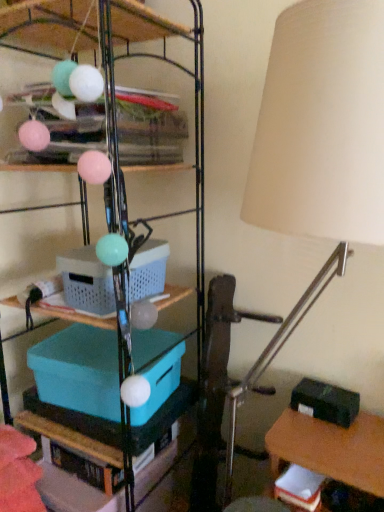
Question: Is black matte storage box at lower right, marked as the 1th storage box in a right-to-left arrangement, closer to camera compared to teal plastic storage box at center-left, acting as the first storage box starting from the left?

Choices:
 (A) yes
 (B) no

Answer: (B)

Question: Considering the relative positions of black matte storage box at lower right, the 3th storage box from the left, and teal plastic storage box at center-left, acting as the first storage box starting from the left, in the image provided, is black matte storage box at lower right, the 3th storage box from the left, to the right of teal plastic storage box at center-left, acting as the first storage box starting from the left, from the viewer's perspective?

Choices:
 (A) yes
 (B) no

Answer: (A)

Question: Does black matte storage box at lower right, which is counted as the third storage box, starting from the top, lie behind teal plastic storage box at center-left, which ranks as the second storage box in bottom-to-top order?

Choices:
 (A) yes
 (B) no

Answer: (A)

Question: Is black matte storage box at lower right, positioned as the first storage box in bottom-to-top order, not close to teal plastic storage box at center-left, which ranks as the third storage box in right-to-left order?

Choices:
 (A) no
 (B) yes

Answer: (A)

Question: Is black matte storage box at lower right, which is counted as the third storage box, starting from the top, positioned beyond the bounds of teal plastic storage box at center-left, acting as the first storage box starting from the left?

Choices:
 (A) yes
 (B) no

Answer: (A)

Question: Can you confirm if black matte storage box at lower right, marked as the 1th storage box in a right-to-left arrangement, is wider than teal plastic storage box at center-left, which ranks as the second storage box in bottom-to-top order?

Choices:
 (A) no
 (B) yes

Answer: (A)

Question: Could you tell me if plastic basket at center, which appears as the 2th storage box when viewed from the left, is facing black matte storage box at lower right, which is counted as the third storage box, starting from the top?

Choices:
 (A) no
 (B) yes

Answer: (A)

Question: Is plastic basket at center, arranged as the 3th storage box when ordered from the bottom, behind black matte storage box at lower right, positioned as the first storage box in bottom-to-top order?

Choices:
 (A) no
 (B) yes

Answer: (A)

Question: Are plastic basket at center, acting as the first storage box starting from the top, and black matte storage box at lower right, marked as the 1th storage box in a right-to-left arrangement, beside each other?

Choices:
 (A) no
 (B) yes

Answer: (A)

Question: Does plastic basket at center, which appears as the 2th storage box when viewed from the left, have a lesser width compared to black matte storage box at lower right, marked as the 1th storage box in a right-to-left arrangement?

Choices:
 (A) no
 (B) yes

Answer: (A)

Question: Can you confirm if plastic basket at center, placed as the 2th storage box when sorted from right to left, is smaller than black matte storage box at lower right, which is counted as the third storage box, starting from the top?

Choices:
 (A) no
 (B) yes

Answer: (A)

Question: Is plastic basket at center, which appears as the 2th storage box when viewed from the left, taller than black matte storage box at lower right, marked as the 1th storage box in a right-to-left arrangement?

Choices:
 (A) yes
 (B) no

Answer: (A)

Question: Is black matte storage box at lower right, which is counted as the third storage box, starting from the top, aimed at metallic wire shelving at upper center, positioned as the second shelf in bottom-to-top order?

Choices:
 (A) no
 (B) yes

Answer: (A)